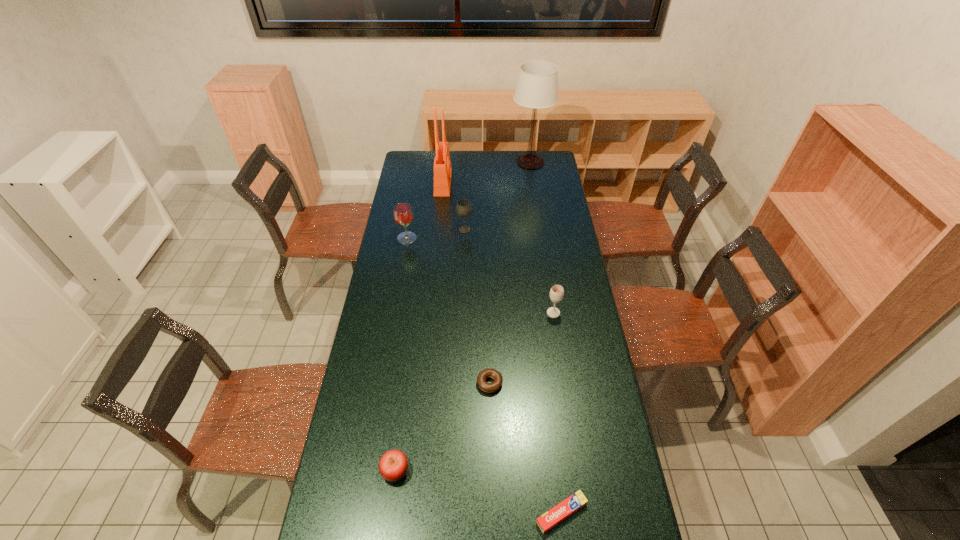
Find the location of a particular element. the nearest object is located at coordinates (551, 518).

Locate an element on the screen. The width and height of the screenshot is (960, 540). toothpaste is located at coordinates (551, 518).

You are a GUI agent. You are given a task and a screenshot of the screen. Output one action in this format:
    pyautogui.click(x=<x>, y=<y>)
    Task: Click on the free space located 0.230m above the cylindrical shade of the table lamp
    The image size is (960, 540).
    Given the screenshot: What is the action you would take?
    pyautogui.click(x=471, y=162)

Where is `vacant space located above the cylindrical shade of the table lamp`? Image resolution: width=960 pixels, height=540 pixels. vacant space located above the cylindrical shade of the table lamp is located at coordinates (487, 162).

This screenshot has height=540, width=960. What are the coordinates of `vacant space located 0.370m above the cylindrical shade of the table lamp` in the screenshot? It's located at (447, 162).

At what (x,y) coordinates should I click in order to perform the action: click on vacant area located on the logo side of the tote bag. Please return your answer as a coordinate pair (x, y). The width and height of the screenshot is (960, 540). Looking at the image, I should click on (476, 183).

Where is `vacant region located 0.270m on the right of the leftmost wineglass`? This screenshot has width=960, height=540. vacant region located 0.270m on the right of the leftmost wineglass is located at coordinates (472, 238).

Locate an element on the screen. This screenshot has height=540, width=960. free space located 0.260m on the left of the second wineglass from right to left is located at coordinates (404, 230).

You are a GUI agent. You are given a task and a screenshot of the screen. Output one action in this format:
    pyautogui.click(x=<x>, y=<y>)
    Task: Click on the free space located on the left of the nearest wineglass
    The height and width of the screenshot is (540, 960).
    Given the screenshot: What is the action you would take?
    pyautogui.click(x=452, y=313)

Find the location of a particular element. The width and height of the screenshot is (960, 540). vacant region located 0.070m on the front of the apple is located at coordinates (390, 510).